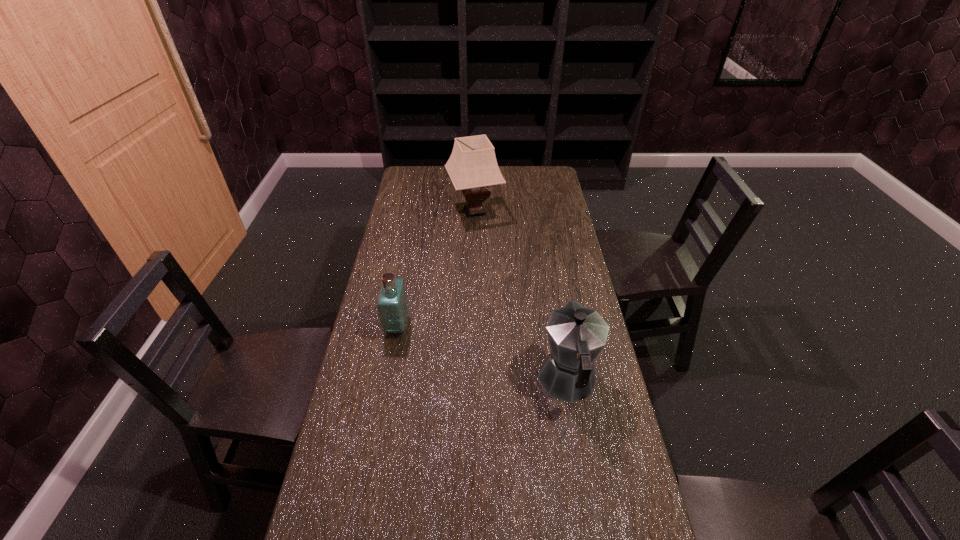
Find the location of a particular element. free space located on the front label of the perfume is located at coordinates (464, 326).

Where is `object that is at the left edge`? This screenshot has width=960, height=540. object that is at the left edge is located at coordinates (392, 307).

The width and height of the screenshot is (960, 540). I want to click on object at the right edge, so click(x=576, y=335).

Where is `vacant area at the left edge of the desktop`? This screenshot has width=960, height=540. vacant area at the left edge of the desktop is located at coordinates (425, 234).

Find the location of `vacant position at the right edge of the desktop`. vacant position at the right edge of the desktop is located at coordinates (545, 256).

The height and width of the screenshot is (540, 960). Identify the location of free space that is in between the second shortest object and the second object from right to left. (521, 297).

You are a GUI agent. You are given a task and a screenshot of the screen. Output one action in this format:
    pyautogui.click(x=<x>, y=<y>)
    Task: Click on the empty location between the nearest object and the shortest object
    Image resolution: width=960 pixels, height=540 pixels.
    Given the screenshot: What is the action you would take?
    pyautogui.click(x=483, y=354)

Identify the location of free spot between the rightmost object and the farthest object. (521, 297).

The width and height of the screenshot is (960, 540). I want to click on free space between the second object from left to right and the nearest object, so click(x=521, y=297).

Where is `object that stands as the closest to the shortest object`? The image size is (960, 540). object that stands as the closest to the shortest object is located at coordinates (576, 335).